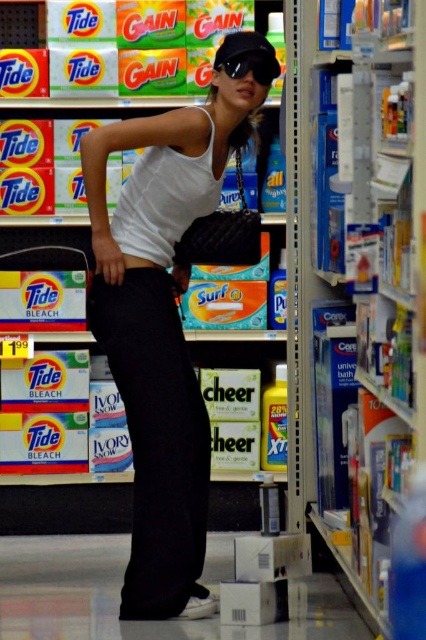
You are standing in a grocery store aisle and want to reach a product located at point (368, 38). If your arm can extend 5 feet, can you reach it without moving?

The distance between you and the point (368, 38) is 8.16 feet, which is farther than your arm can reach. You will need to move closer to reach it.

You are a delivery person who needs to retrieve the matte black purse at center from behind the blue cardboard boxes at center. Can you reach it without moving the boxes?

The blue cardboard boxes at center is in front of the matte black purse at center, so you cannot reach the matte black purse at center without moving the boxes.

You are standing in a grocery store aisle where a person is leaning against a laundry detergent shelf. You want to take a photo of the point at coordinates [403,234]. If you are 8.13 feet away from that point, is the distance within a typical smartphone camera focus range for clear photos?

The point at coordinates [403,234] is 8.13 feet away from the viewer. Most smartphone cameras have a focus range starting around 1 foot and extending to infinity, so 8.13 feet is well within the typical focus range for a clear photo.